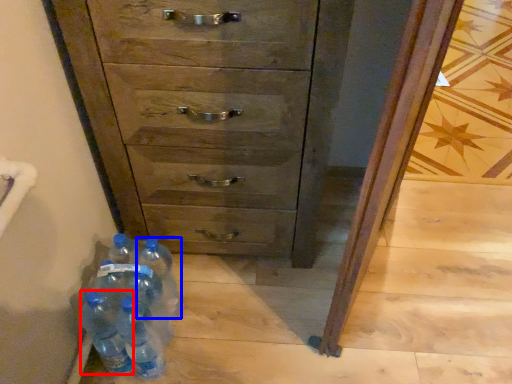
Question: Which object appears farthest to the camera in this image, bottle (highlighted by a red box) or bottle (highlighted by a blue box)?

Choices:
 (A) bottle
 (B) bottle

Answer: (B)